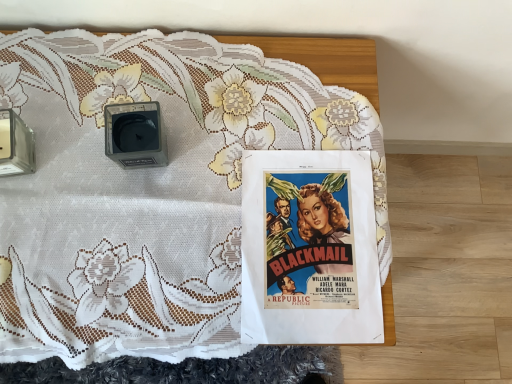
Question: Is white lace tablecloth at center oriented away from matte black alarm clock at upper left?

Choices:
 (A) yes
 (B) no

Answer: (B)

Question: Can you confirm if white lace tablecloth at center is positioned to the right of matte black alarm clock at upper left?

Choices:
 (A) yes
 (B) no

Answer: (A)

Question: From a real-world perspective, does white lace tablecloth at center stand above matte black alarm clock at upper left?

Choices:
 (A) yes
 (B) no

Answer: (B)

Question: From a real-world perspective, is white lace tablecloth at center positioned under matte black alarm clock at upper left based on gravity?

Choices:
 (A) yes
 (B) no

Answer: (A)

Question: Is white lace tablecloth at center positioned before matte black alarm clock at upper left?

Choices:
 (A) yes
 (B) no

Answer: (A)

Question: Is white lace tablecloth at center with matte black alarm clock at upper left?

Choices:
 (A) yes
 (B) no

Answer: (B)

Question: From a real-world perspective, does matte black alarm clock at upper left stand above vivid paper poster at center?

Choices:
 (A) no
 (B) yes

Answer: (B)

Question: Considering the relative positions of matte black alarm clock at upper left and vivid paper poster at center in the image provided, is matte black alarm clock at upper left to the right of vivid paper poster at center from the viewer's perspective?

Choices:
 (A) yes
 (B) no

Answer: (B)

Question: Is matte black alarm clock at upper left with vivid paper poster at center?

Choices:
 (A) yes
 (B) no

Answer: (B)

Question: Considering the relative sizes of matte black alarm clock at upper left and vivid paper poster at center in the image provided, is matte black alarm clock at upper left shorter than vivid paper poster at center?

Choices:
 (A) no
 (B) yes

Answer: (A)

Question: Is matte black alarm clock at upper left surrounding vivid paper poster at center?

Choices:
 (A) yes
 (B) no

Answer: (B)

Question: Considering the relative positions of matte black alarm clock at upper left and vivid paper poster at center in the image provided, is matte black alarm clock at upper left to the left of vivid paper poster at center from the viewer's perspective?

Choices:
 (A) no
 (B) yes

Answer: (B)

Question: From the image's perspective, is matte black alarm clock at upper left on white lace tablecloth at center?

Choices:
 (A) yes
 (B) no

Answer: (A)